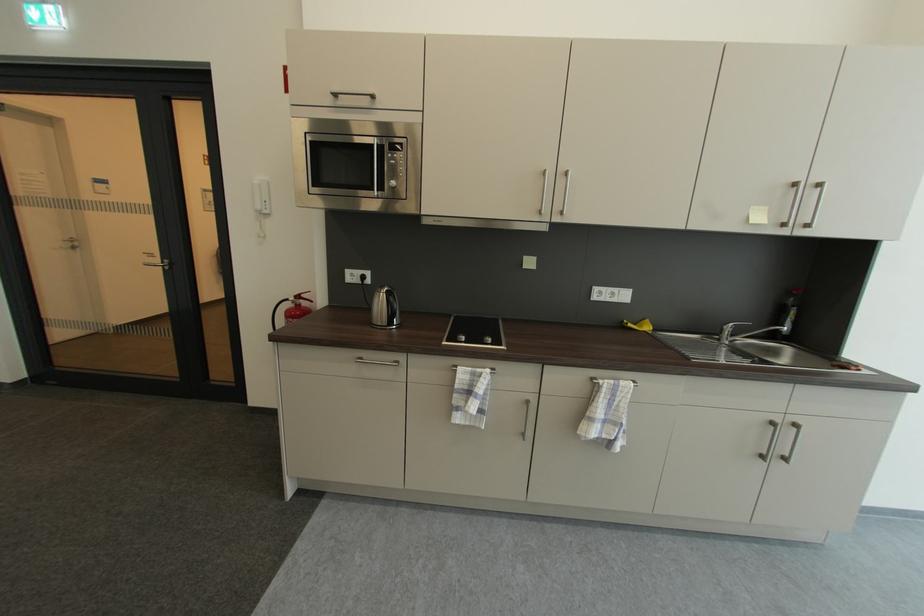
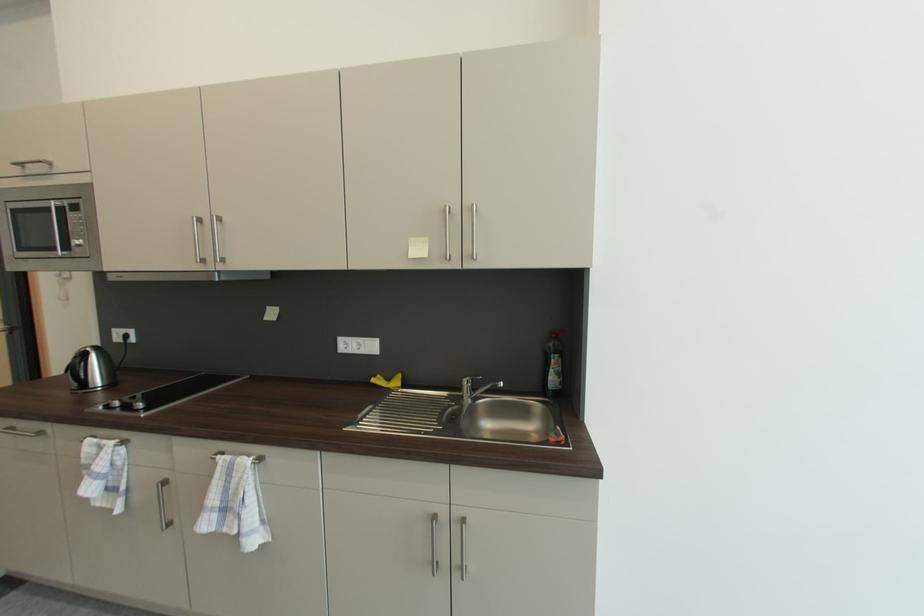
Question: What movement of the cameraman would produce the second image?

Choices:
 (A) Left
 (B) Right
 (C) Forward
 (D) Backward

Answer: (B)